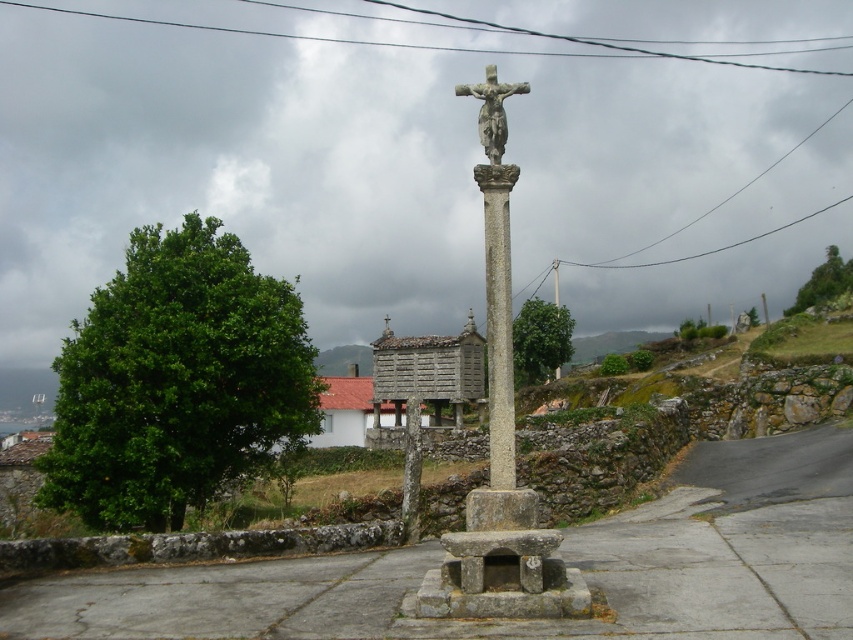
Looking at this image, how much distance is there between stone crucifix at center and stone statue at center?

stone crucifix at center and stone statue at center are 10.64 meters apart.

Is point (506, 88) in front of point (515, 88)?

Yes, it is.

In the scene shown: Who is more forward, (x=495, y=248) or (x=489, y=134)?

Point (x=495, y=248) is in front.

What are the coordinates of `stone crucifix at center` in the screenshot? It's located at (496, 269).

Which is more to the right, stone crucifix at center or gray stone column at center?

gray stone column at center

Does stone crucifix at center have a greater width compared to gray stone column at center?

Correct, the width of stone crucifix at center exceeds that of gray stone column at center.

Locate an element on the screen. stone crucifix at center is located at coordinates (496, 269).

Who is more forward, (476, 88) or (410, 531)?

Point (476, 88) is more forward.

Does stone statue at center come behind stone cross at center?

That is False.

Who is more distant from viewer, (496, 112) or (407, 451)?

Point (407, 451)

Locate an element on the screen. Image resolution: width=853 pixels, height=640 pixels. stone statue at center is located at coordinates (491, 109).